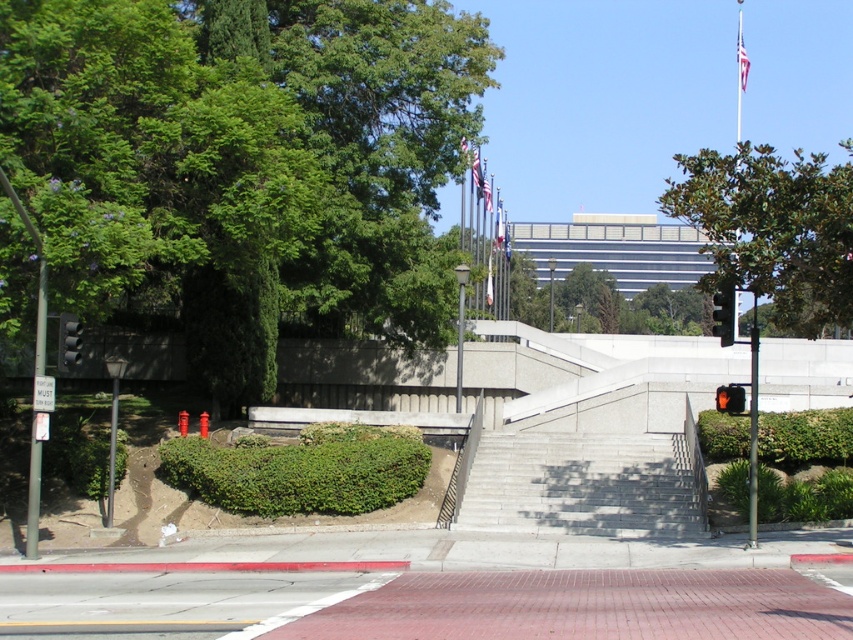
Is black glass traffic light at left shorter than orange plastic traffic light at center?

No.

Locate an element on the screen. The width and height of the screenshot is (853, 640). black glass traffic light at left is located at coordinates (68, 340).

The width and height of the screenshot is (853, 640). What do you see at coordinates (805, 436) in the screenshot?
I see `green leafy hedge at center` at bounding box center [805, 436].

Does green leafy hedge at center lie in front of white fabric flag at center?

Yes.

The image size is (853, 640). Describe the element at coordinates (805, 436) in the screenshot. I see `green leafy hedge at center` at that location.

This screenshot has height=640, width=853. In order to click on green leafy hedge at center in this screenshot , I will do `click(805, 436)`.

Looking at this image, is green leafy hedge at lower center wider than black plastic traffic light at right?

Yes.

Which of these two, green leafy hedge at lower center or black plastic traffic light at right, stands shorter?

black plastic traffic light at right

Locate an element on the screen. This screenshot has height=640, width=853. green leafy hedge at lower center is located at coordinates (300, 472).